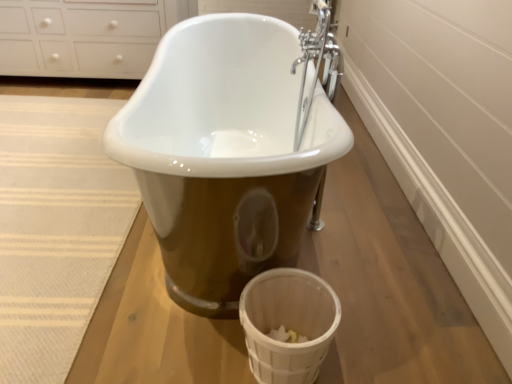
Question: Is the position of beige woven rug at lower left less distant than that of white woven basket at lower right?

Choices:
 (A) yes
 (B) no

Answer: (B)

Question: From a real-world perspective, is beige woven rug at lower left beneath white woven basket at lower right?

Choices:
 (A) no
 (B) yes

Answer: (B)

Question: Does beige woven rug at lower left appear on the right side of white woven basket at lower right?

Choices:
 (A) no
 (B) yes

Answer: (A)

Question: Is white woven basket at lower right a part of beige woven rug at lower left?

Choices:
 (A) no
 (B) yes

Answer: (A)

Question: Would you consider beige woven rug at lower left to be distant from white woven basket at lower right?

Choices:
 (A) yes
 (B) no

Answer: (B)

Question: From their relative heights in the image, would you say white woven basket at lower right is taller or shorter than white glossy cabinet at upper left?

Choices:
 (A) short
 (B) tall

Answer: (A)

Question: From a real-world perspective, relative to white glossy cabinet at upper left, is white woven basket at lower right vertically above or below?

Choices:
 (A) below
 (B) above

Answer: (A)

Question: Relative to white glossy cabinet at upper left, is white woven basket at lower right in front or behind?

Choices:
 (A) front
 (B) behind

Answer: (A)

Question: Is white woven basket at lower right inside the boundaries of white glossy cabinet at upper left, or outside?

Choices:
 (A) inside
 (B) outside

Answer: (B)

Question: From a real-world perspective, is beige woven rug at lower left positioned above or below white glossy cabinet at upper left?

Choices:
 (A) below
 (B) above

Answer: (A)

Question: From the image's perspective, is beige woven rug at lower left above or below white glossy cabinet at upper left?

Choices:
 (A) above
 (B) below

Answer: (B)

Question: Is beige woven rug at lower left inside the boundaries of white glossy cabinet at upper left, or outside?

Choices:
 (A) outside
 (B) inside

Answer: (A)

Question: Does point (30, 299) appear closer or farther from the camera than point (91, 48)?

Choices:
 (A) farther
 (B) closer

Answer: (B)

Question: Is white glossy cabinet at upper left to the left or to the right of white woven basket at lower right in the image?

Choices:
 (A) left
 (B) right

Answer: (A)

Question: Considering the positions of white glossy cabinet at upper left and white woven basket at lower right in the image, is white glossy cabinet at upper left wider or thinner than white woven basket at lower right?

Choices:
 (A) wide
 (B) thin

Answer: (A)